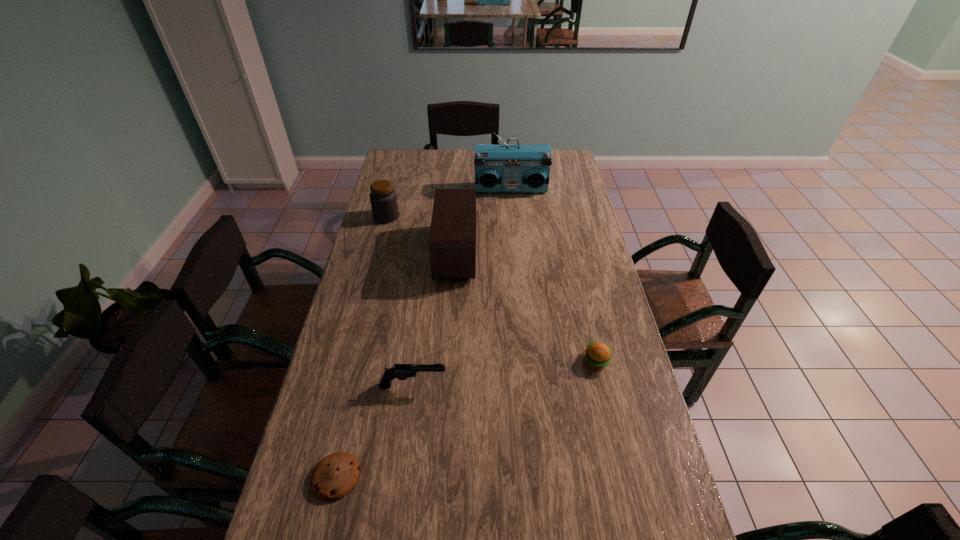
The height and width of the screenshot is (540, 960). I want to click on vacant space that satisfies the following two spatial constraints: 1. on the surface of the fifth tallest object near the warning symbol; 2. on the right side of the second farthest object, so click(x=349, y=361).

At what (x,y) coordinates should I click in order to perform the action: click on vacant region that satisfies the following two spatial constraints: 1. on the front-facing side of the farthest object; 2. at the end of the barrel of the third shortest object. Please return your answer as a coordinate pair (x, y). Looking at the image, I should click on (529, 385).